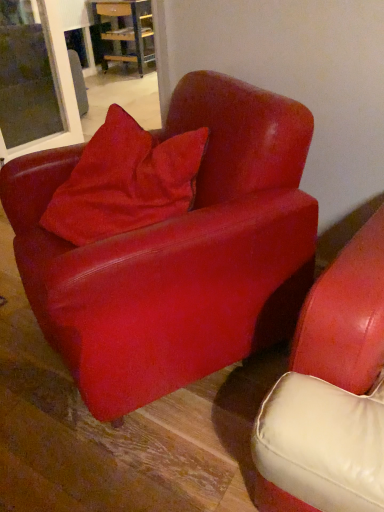
Question: Is transparent glass window at upper left to the left of wooden table at center from the viewer's perspective?

Choices:
 (A) no
 (B) yes

Answer: (B)

Question: Is transparent glass window at upper left to the right of wooden table at center from the viewer's perspective?

Choices:
 (A) no
 (B) yes

Answer: (A)

Question: Does transparent glass window at upper left turn towards wooden table at center?

Choices:
 (A) yes
 (B) no

Answer: (A)

Question: From the image's perspective, is transparent glass window at upper left above wooden table at center?

Choices:
 (A) yes
 (B) no

Answer: (B)

Question: Is wooden table at center inside transparent glass window at upper left?

Choices:
 (A) no
 (B) yes

Answer: (A)

Question: From a real-world perspective, is transparent glass window at upper left located beneath wooden table at center?

Choices:
 (A) yes
 (B) no

Answer: (A)

Question: Considering the relative sizes of wooden table at center and velvet red pillow at center in the image provided, is wooden table at center bigger than velvet red pillow at center?

Choices:
 (A) yes
 (B) no

Answer: (A)

Question: Is wooden table at center at the left side of velvet red pillow at center?

Choices:
 (A) yes
 (B) no

Answer: (A)

Question: Is wooden table at center positioned before velvet red pillow at center?

Choices:
 (A) yes
 (B) no

Answer: (B)

Question: Is the position of wooden table at center more distant than that of velvet red pillow at center?

Choices:
 (A) no
 (B) yes

Answer: (B)

Question: Is wooden table at center smaller than velvet red pillow at center?

Choices:
 (A) no
 (B) yes

Answer: (A)

Question: Can we say wooden table at center lies outside velvet red pillow at center?

Choices:
 (A) no
 (B) yes

Answer: (B)

Question: Is matte red armchair at center to the left of wooden table at center from the viewer's perspective?

Choices:
 (A) yes
 (B) no

Answer: (B)